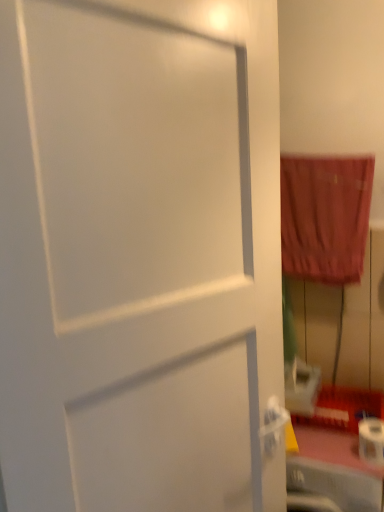
Question: Does white matte toilet paper at lower right come behind velvet-like red curtain at right?

Choices:
 (A) no
 (B) yes

Answer: (A)

Question: From the image's perspective, is white matte toilet paper at lower right above velvet-like red curtain at right?

Choices:
 (A) no
 (B) yes

Answer: (A)

Question: Would you say white matte toilet paper at lower right contains velvet-like red curtain at right?

Choices:
 (A) yes
 (B) no

Answer: (B)

Question: Is the depth of white matte toilet paper at lower right less than that of velvet-like red curtain at right?

Choices:
 (A) yes
 (B) no

Answer: (A)

Question: Is white matte toilet paper at lower right not within velvet-like red curtain at right?

Choices:
 (A) no
 (B) yes

Answer: (B)

Question: Does white matte toilet paper at lower right have a greater width compared to velvet-like red curtain at right?

Choices:
 (A) yes
 (B) no

Answer: (A)

Question: Is velvet-like red curtain at right positioned behind white matte toilet paper at lower right?

Choices:
 (A) no
 (B) yes

Answer: (B)

Question: Are velvet-like red curtain at right and white matte toilet paper at lower right far apart?

Choices:
 (A) no
 (B) yes

Answer: (A)

Question: Are velvet-like red curtain at right and white matte toilet paper at lower right making contact?

Choices:
 (A) yes
 (B) no

Answer: (B)

Question: Considering the relative positions of velvet-like red curtain at right and white matte toilet paper at lower right in the image provided, is velvet-like red curtain at right to the left of white matte toilet paper at lower right from the viewer's perspective?

Choices:
 (A) yes
 (B) no

Answer: (A)

Question: From a real-world perspective, is velvet-like red curtain at right beneath white matte toilet paper at lower right?

Choices:
 (A) yes
 (B) no

Answer: (B)

Question: Is the depth of velvet-like red curtain at right less than that of white matte toilet paper at lower right?

Choices:
 (A) yes
 (B) no

Answer: (B)

Question: In terms of size, does velvet-like red curtain at right appear bigger or smaller than white matte toilet paper at lower right?

Choices:
 (A) small
 (B) big

Answer: (B)